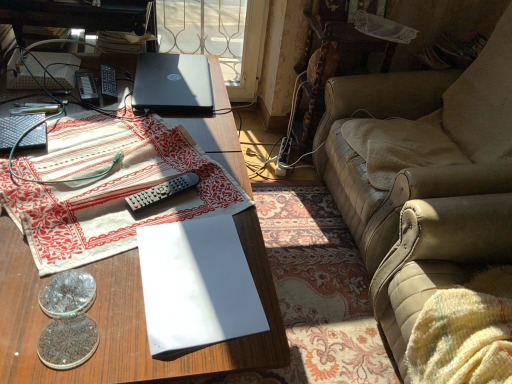
Locate an element on the screen. vacant space in between white paper at center, marked as the first paperback book in a front-to-back arrangement, and translucent glass coins at lower left, the first coin viewed from the front is located at coordinates (122, 295).